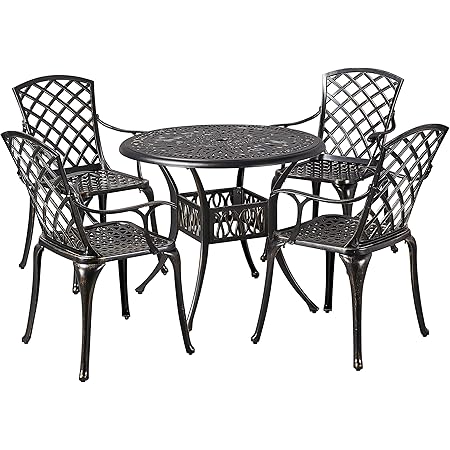
Find the location of a particular element. table legs is located at coordinates (200, 260), (168, 176), (241, 174), (300, 285).